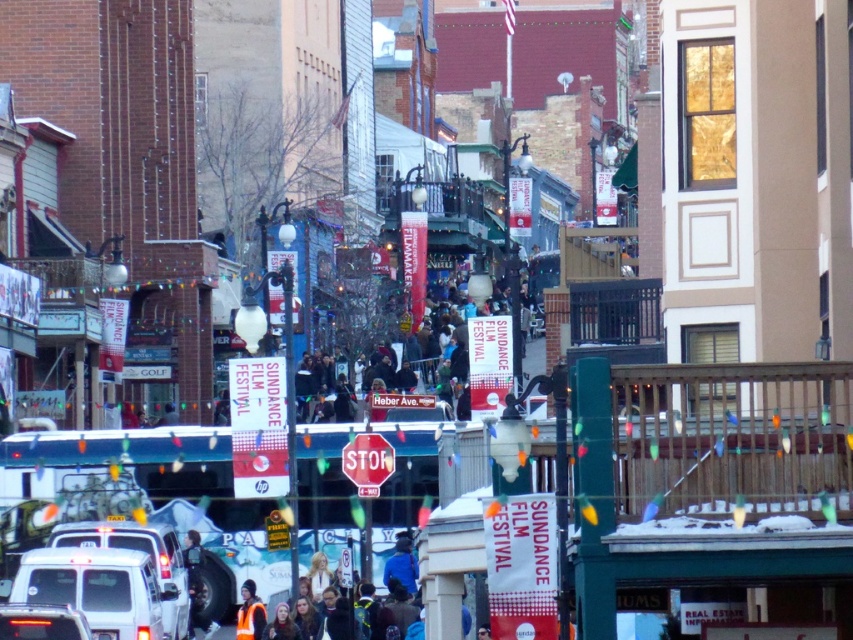
Consider the image. You are standing at the stop sign in the center of the street. You see two points marked on the ground. The first point is at coordinate point[370,472] and the second point is at coordinate point[254,636]. Which point is closer to you?

The point at coordinate point[370,472] is closer to you than the point at coordinate point[254,636].

In the scene shown: You are standing at the point labeled with coordinates point (367,461). What object are you directly at?

The point (367,461) indicates the metallic reflective stop sign at center.